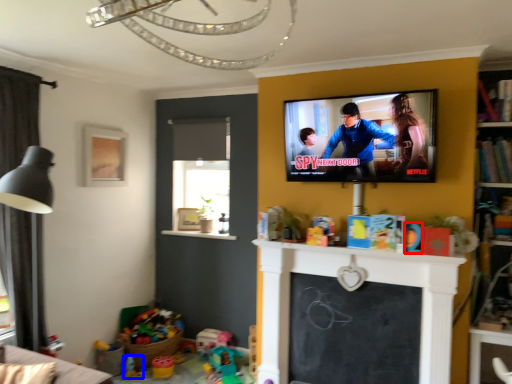
Question: Which of the following is the closest to the observer, toy (highlighted by a red box) or toy (highlighted by a blue box)?

Choices:
 (A) toy
 (B) toy

Answer: (A)